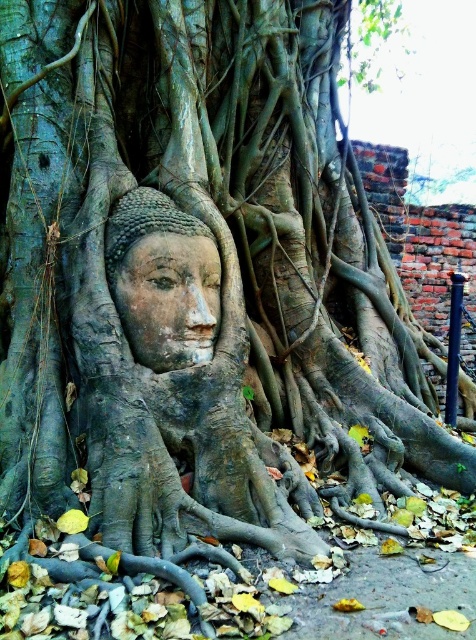
Between point (138, 195) and point (129, 280), which one is positioned in front?

Point (129, 280)

Is point (119, 428) closer to viewer compared to point (157, 326)?

Yes, point (119, 428) is in front of point (157, 326).

Which is in front, point (241, 516) or point (195, 332)?

Point (241, 516)

At what (x,y) coordinates should I click in order to perform the action: click on gray stone buddha head at center. Please return your answer as a coordinate pair (x, y). The width and height of the screenshot is (476, 640). Looking at the image, I should click on (180, 403).